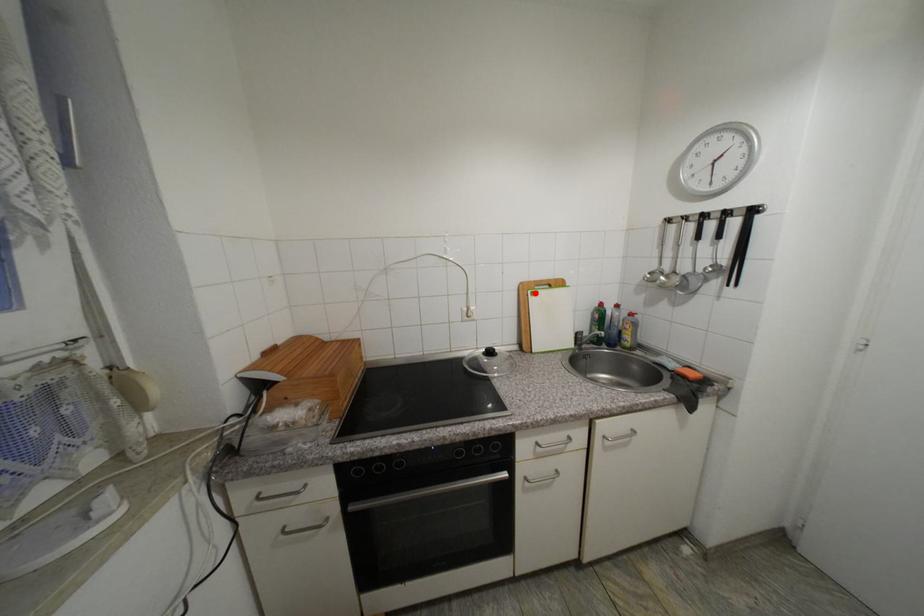
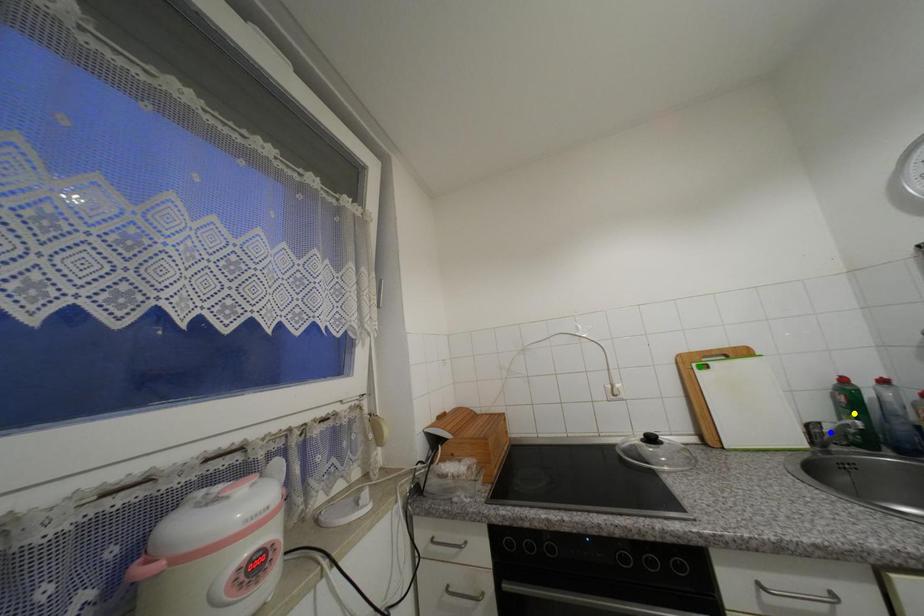
Question: I am providing you with two images of the same scene from different viewpoints. A red point is marked on the first image. You are given multiple points on the second image. Which spot in image 2 lines up with the point in image 1?

Choices:
 (A) green point
 (B) blue point
 (C) yellow point

Answer: (A)